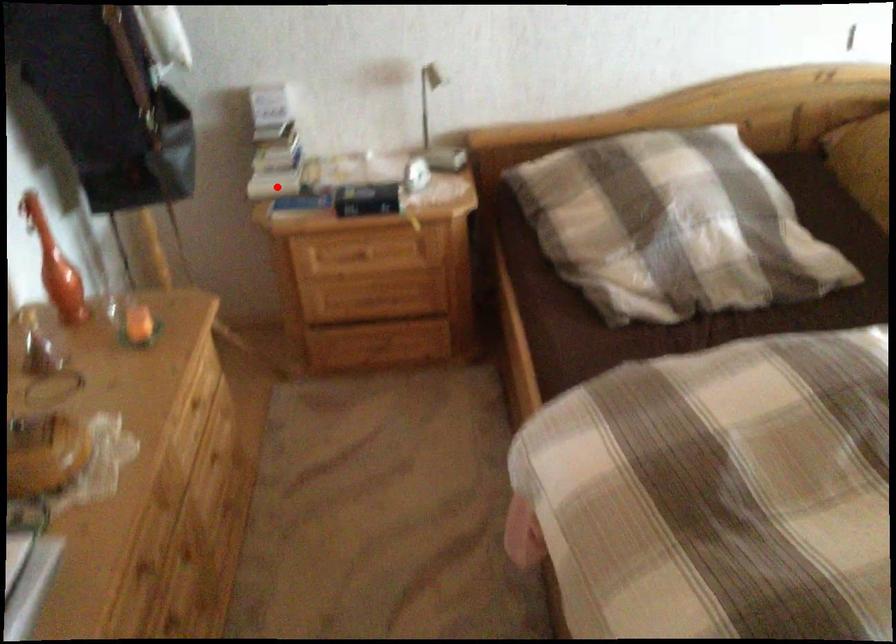
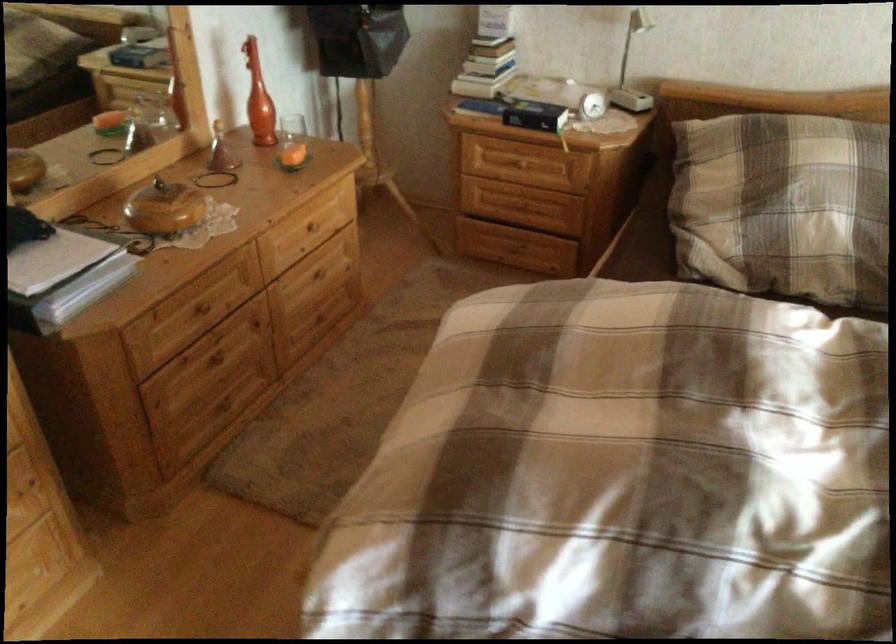
Question: A red point is marked in image1. In image2, is the corresponding 3D point closer to the camera or farther? Reply with the corresponding letter.

Choices:
 (A) The corresponding 3D point is closer.
 (B) The corresponding 3D point is farther.

Answer: (B)